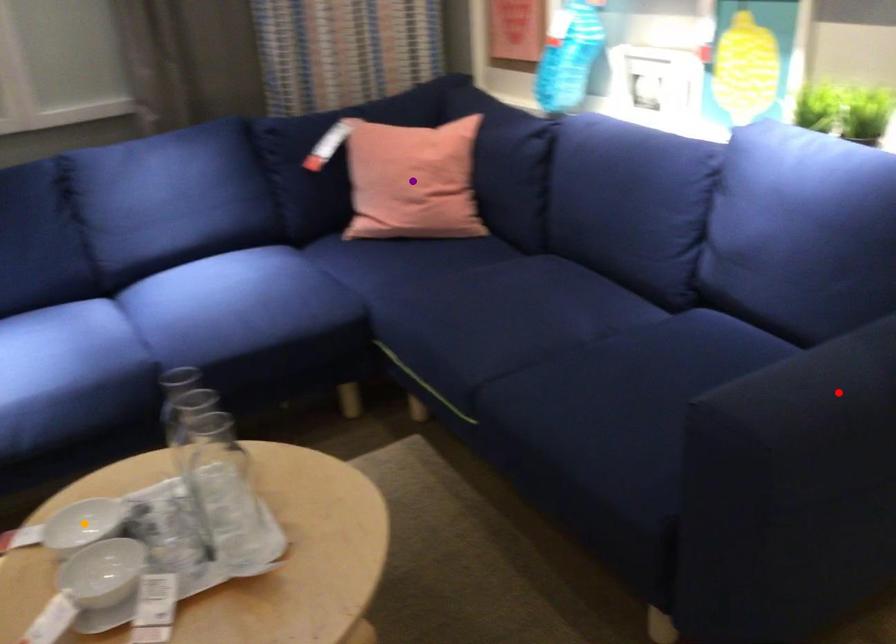
Order these from nearest to farthest:
- purple point
- red point
- orange point

1. red point
2. orange point
3. purple point